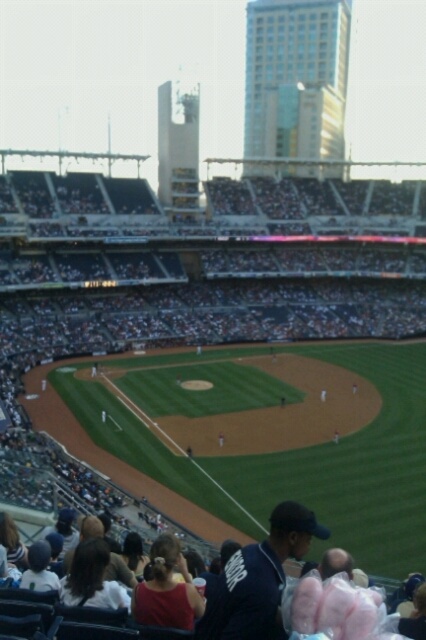
You are a photographer trying to capture a candid shot of both the dark blue jersey at lower center and the matte red shirt at lower center in the same frame. Considering their sizes, which one might you need to zoom in closer to include fully in the photo?

The matte red shirt at lower center is narrower than the dark blue jersey at lower center, so you would need to zoom in closer to include the wider dark blue jersey at lower center fully in the photo.

You are a photographer standing in the stands of a baseball stadium. You want to take a photo of both the dark blue jersey at lower center and the matte red shirt at lower center in the same frame. The camera you are using has a maximum focus range of 3 meters. Will you be able to capture both subjects in focus?

The distance between the dark blue jersey at lower center and the matte red shirt at lower center is 3.10 meters. Since the camera can only focus within 3 meters, the subjects are slightly out of the focus range. Therefore, you won technical difficulties icon, but you can try moving closer to reduce the distance between them or use a different camera setting to increase the depth of field.